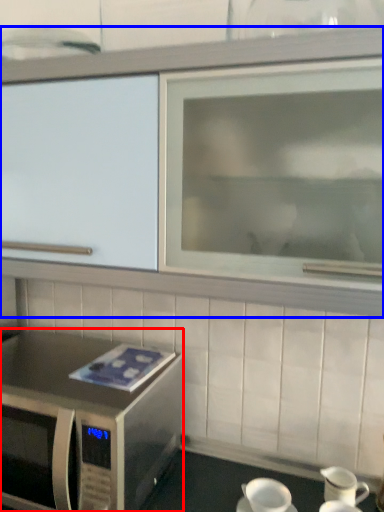
Question: Which of the following is the farthest to the observer, microwave oven (highlighted by a red box) or cabinetry (highlighted by a blue box)?

Choices:
 (A) microwave oven
 (B) cabinetry

Answer: (A)